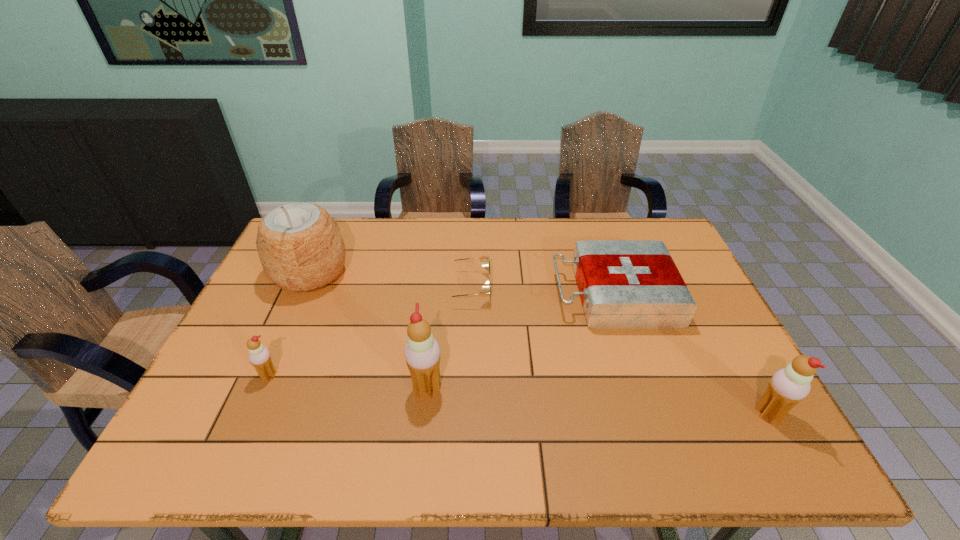
Please determine a free point for an extra icecream to ensure balance. Please provide its 2D coordinates. Your answer should be formatted as a tuple, i.e. [(x, y)], where the tuple contains the x and y coordinates of a point satisfying the conditions above.

[(593, 400)]